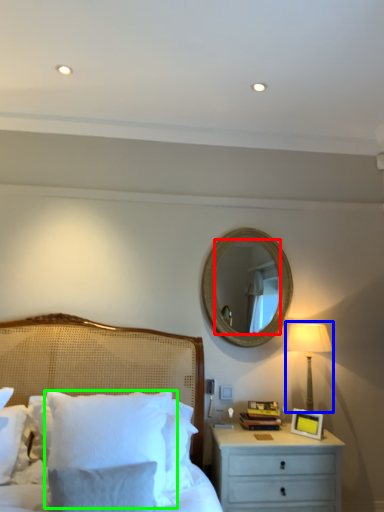
Question: Which object is the farthest from mirror (highlighted by a red box)? Choose among these: bedside lamp (highlighted by a blue box) or pillow (highlighted by a green box).

Choices:
 (A) bedside lamp
 (B) pillow

Answer: (B)